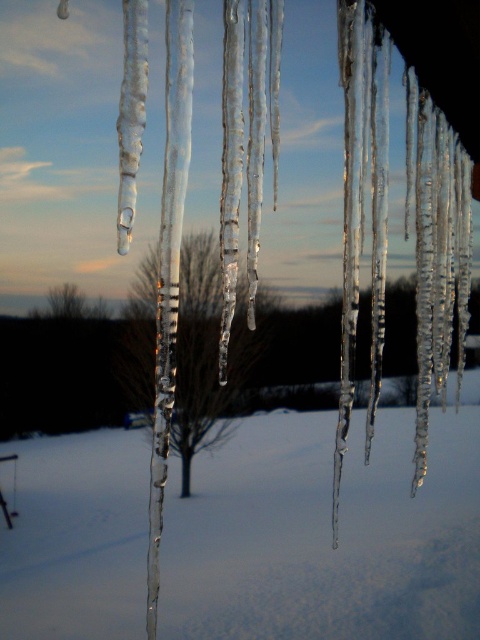
You are standing at the center of the winter scene and want to reach the transparent ice icicles at center. Given that the coordinates of your current position are point [326,532], can you directly move towards them without any obstacles?

The transparent ice icicles at center are located exactly at point [326,532], which is your current position. Therefore, you are already at the location of the transparent ice icicles at center and do not need to move.

You are an ice sculptor observing the winter scene. You need to determine which object at the center has a greater width for your next project. Which one is wider between the transparent ice icicles at center and the bare branches at center?

The transparent ice icicles at center has a greater width than the bare branches at center according to the description.

You are an observer looking at the winter scene. You notice the transparent ice icicles at center and the bare branches at center. Which object is positioned higher in the image?

The bare branches at center are positioned higher than the transparent ice icicles at center because the icicles are located below the branches.